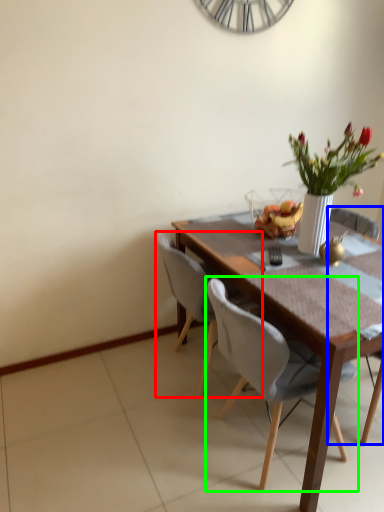
Question: Which object is the closest to the chair (highlighted by a red box)? Choose among these: chair (highlighted by a blue box) or chair (highlighted by a green box).

Choices:
 (A) chair
 (B) chair

Answer: (B)